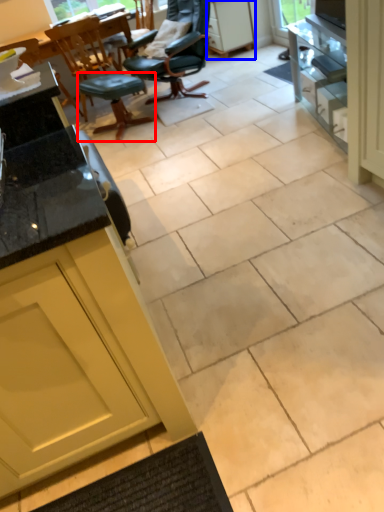
Question: Among these objects, which one is farthest to the camera, stool (highlighted by a red box) or cabinetry (highlighted by a blue box)?

Choices:
 (A) stool
 (B) cabinetry

Answer: (B)